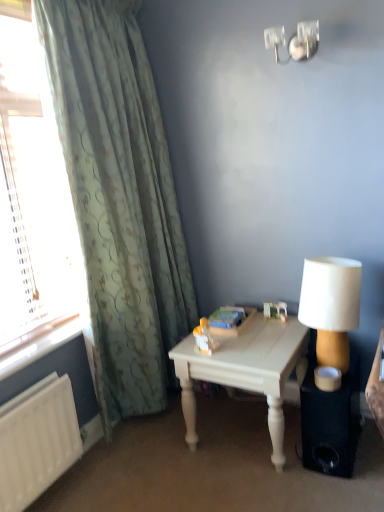
Image resolution: width=384 pixels, height=512 pixels. What do you see at coordinates (33, 192) in the screenshot?
I see `clear glass window at left` at bounding box center [33, 192].

Identify the location of white fabric lampshade at right. (331, 306).

This screenshot has width=384, height=512. Describe the element at coordinates (294, 41) in the screenshot. I see `metallic wall sconce at upper right` at that location.

What are the coordinates of `clear glass window at left` in the screenshot? It's located at (33, 192).

Is black matte speaker at lower right a part of metallic wall sconce at upper right?

No, black matte speaker at lower right is not inside metallic wall sconce at upper right.

Is the depth of metallic wall sconce at upper right less than that of black matte speaker at lower right?

No, it is behind black matte speaker at lower right.

Is metallic wall sconce at upper right facing towards black matte speaker at lower right?

No, metallic wall sconce at upper right is not facing towards black matte speaker at lower right.

Is black matte speaker at lower right not within white fabric lampshade at right?

Yes, black matte speaker at lower right is located beyond the bounds of white fabric lampshade at right.

From the image's perspective, between black matte speaker at lower right and white fabric lampshade at right, which one is located above?

white fabric lampshade at right is shown above in the image.

In terms of height, does black matte speaker at lower right look taller or shorter compared to white fabric lampshade at right?

In the image, black matte speaker at lower right appears to be shorter than white fabric lampshade at right.

Which is farther from the camera, (96, 212) or (333, 315)?

The point (96, 212) is behind.

Is green textured curtain at left in contact with white fabric lampshade at right?

No, green textured curtain at left is not with white fabric lampshade at right.

Based on the photo, is green textured curtain at left at the left side of white fabric lampshade at right?

Yes, green textured curtain at left is to the left of white fabric lampshade at right.

Is white fabric lampshade at right surrounded by green textured curtain at left?

No, white fabric lampshade at right is not a part of green textured curtain at left.

Is metallic wall sconce at upper right at the back of white fabric lampshade at right?

No, metallic wall sconce at upper right is not at the back of white fabric lampshade at right.

From the image's perspective, is white fabric lampshade at right above or below metallic wall sconce at upper right?

white fabric lampshade at right is situated lower than metallic wall sconce at upper right in the image.

Which is in front, white fabric lampshade at right or metallic wall sconce at upper right?

Positioned in front is white fabric lampshade at right.

Considering the sizes of objects white fabric lampshade at right and metallic wall sconce at upper right in the image provided, who is bigger, white fabric lampshade at right or metallic wall sconce at upper right?

With larger size is white fabric lampshade at right.

Where is `fixture that appears above the white fabric lampshade at right (from a real-world perspective)`? This screenshot has height=512, width=384. fixture that appears above the white fabric lampshade at right (from a real-world perspective) is located at coordinates (294, 41).

From a real-world perspective, which is physically above, metallic wall sconce at upper right or white fabric lampshade at right?

In real-world perspective, metallic wall sconce at upper right is above.

From the image's perspective, relative to white fabric lampshade at right, is metallic wall sconce at upper right above or below?

metallic wall sconce at upper right is above white fabric lampshade at right.

Can you confirm if black matte speaker at lower right is positioned to the right of metallic wall sconce at upper right?

Yes, black matte speaker at lower right is to the right of metallic wall sconce at upper right.

Is point (321, 442) behind point (318, 31)?

That is False.

How far apart are black matte speaker at lower right and metallic wall sconce at upper right?

A distance of 1.48 meters exists between black matte speaker at lower right and metallic wall sconce at upper right.

From the image's perspective, between black matte speaker at lower right and metallic wall sconce at upper right, which one is located above?

From the image's view, metallic wall sconce at upper right is above.

What's the angular difference between white fabric lampshade at right and clear glass window at left's facing directions?

They differ by 91.8 degrees in their facing directions.

From a real-world perspective, which object stands above the other?

clear glass window at left.

Is clear glass window at left at the back of white fabric lampshade at right?

That's not correct — white fabric lampshade at right is not looking away from clear glass window at left.

The image size is (384, 512). Identify the location of fixture that is above the black matte speaker at lower right (from a real-world perspective). (294, 41).

Locate an element on the screen. This screenshot has height=512, width=384. loudspeaker below the white fabric lampshade at right (from the image's perspective) is located at coordinates (331, 423).

Based on their spatial positions, is white fabric lampshade at right or clear glass window at left further from white painted wood table at center?

clear glass window at left is positioned further to the anchor white painted wood table at center.

When comparing their distances from white fabric lampshade at right, does white painted wood table at center or green textured curtain at left seem further?

green textured curtain at left is positioned further to the anchor white fabric lampshade at right.

Based on their spatial positions, is clear glass window at left or black matte speaker at lower right closer to white fabric lampshade at right?

Based on the image, black matte speaker at lower right appears to be nearer to white fabric lampshade at right.

Based on their spatial positions, is white painted wood table at center or metallic wall sconce at upper right further from black matte speaker at lower right?

metallic wall sconce at upper right.

From the image, which object appears to be farther from white fabric lampshade at right, black matte speaker at lower right or metallic wall sconce at upper right?

Based on the image, metallic wall sconce at upper right appears to be further to white fabric lampshade at right.

Estimate the real-world distances between objects in this image. Which object is further from white painted wood table at center, metallic wall sconce at upper right or clear glass window at left?

The object further to white painted wood table at center is metallic wall sconce at upper right.

When comparing their distances from green textured curtain at left, does metallic wall sconce at upper right or clear glass window at left seem closer?

clear glass window at left is closer to green textured curtain at left.

When comparing their distances from black matte speaker at lower right, does green textured curtain at left or white fabric lampshade at right seem closer?

white fabric lampshade at right lies closer to black matte speaker at lower right than the other object.

Identify the location of lamp between clear glass window at left and black matte speaker at lower right in the horizontal direction. (331, 306).

In order to click on curtain between clear glass window at left and black matte speaker at lower right in the horizontal direction in this screenshot , I will do `click(119, 199)`.

The image size is (384, 512). Identify the location of table situated between green textured curtain at left and white fabric lampshade at right from left to right. (246, 370).

Where is `table between clear glass window at left and black matte speaker at lower right from left to right`? This screenshot has height=512, width=384. table between clear glass window at left and black matte speaker at lower right from left to right is located at coordinates (246, 370).